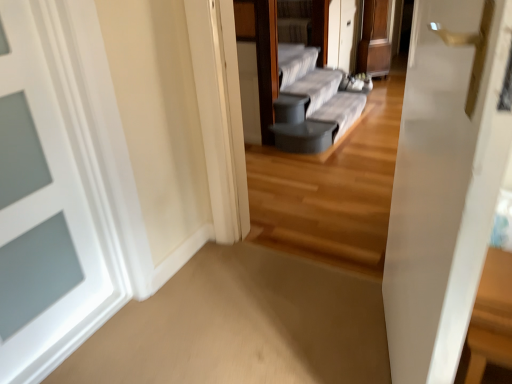
Question: Does point (474, 311) appear closer or farther from the camera than point (35, 241)?

Choices:
 (A) closer
 (B) farther

Answer: (A)

Question: Based on their positions, is wooden table at right located to the left or right of white painted wood door at left?

Choices:
 (A) left
 (B) right

Answer: (B)

Question: Based on their relative distances, which object is nearer to the gray fabric couch at center?

Choices:
 (A) wooden table at right
 (B) white painted wood door at left

Answer: (B)

Question: Which object is positioned farthest from the wooden table at right?

Choices:
 (A) gray fabric couch at center
 (B) white painted wood door at left

Answer: (A)